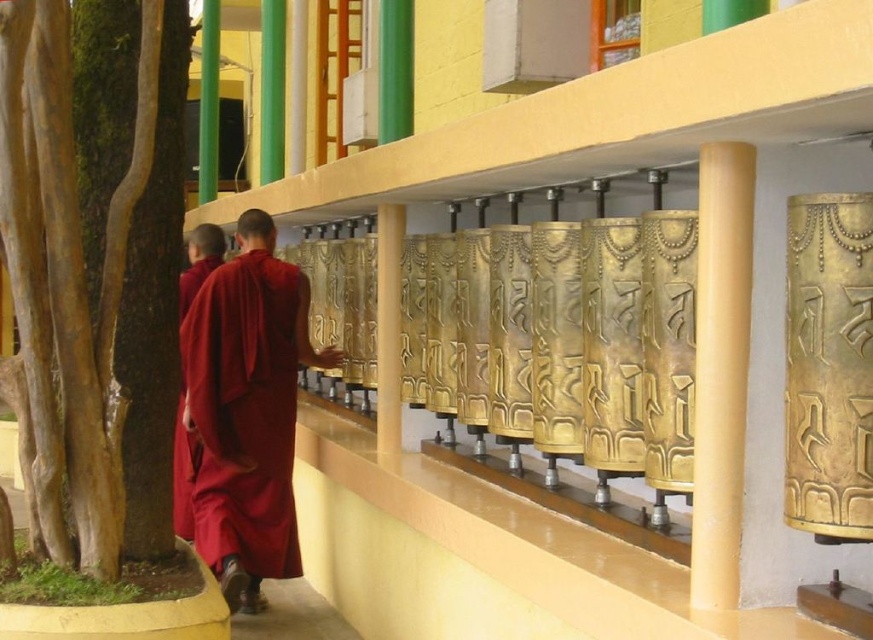
Question: Can you confirm if smooth brown bark at left is positioned above maroon cloth monk at left?

Choices:
 (A) no
 (B) yes

Answer: (B)

Question: Is smooth brown bark at left below maroon cloth monk at left?

Choices:
 (A) yes
 (B) no

Answer: (B)

Question: Can you confirm if maroon cloth monk at center is positioned above maroon cloth monk at left?

Choices:
 (A) yes
 (B) no

Answer: (A)

Question: Which object is farther from the camera taking this photo?

Choices:
 (A) smooth brown bark at left
 (B) maroon cloth monk at left

Answer: (B)

Question: Which point is closer to the camera?

Choices:
 (A) (184, 468)
 (B) (253, 394)
 (C) (122, 179)

Answer: (C)

Question: Which point appears closest to the camera in this image?

Choices:
 (A) (177, 525)
 (B) (260, 243)

Answer: (B)